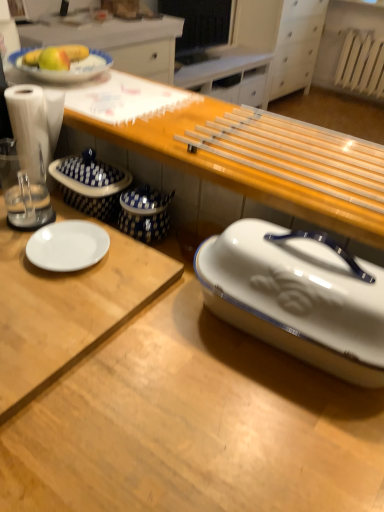
Where is `free space in front of white glossy breadbox at lower right`? The height and width of the screenshot is (512, 384). free space in front of white glossy breadbox at lower right is located at coordinates (272, 430).